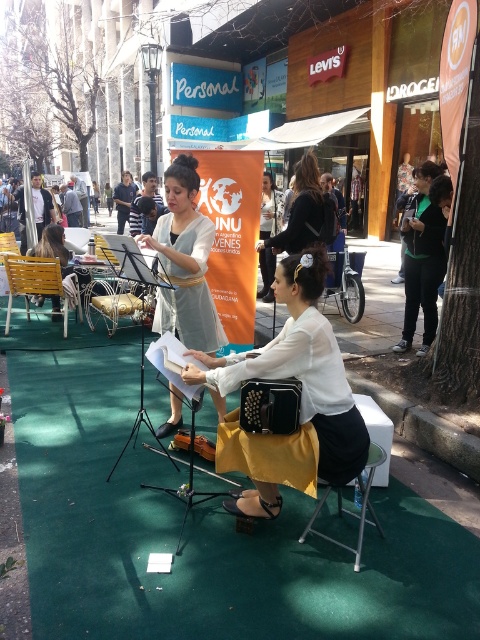
Question: Is white matte accordion at center positioned before matte black hairband at center?

Choices:
 (A) no
 (B) yes

Answer: (B)

Question: Which of the following is the closest to the observer?

Choices:
 (A) (74, 273)
 (B) (6, 328)

Answer: (B)

Question: Considering the relative positions of matte gray dress at center and wooden accordion at center in the image provided, where is matte gray dress at center located with respect to wooden accordion at center?

Choices:
 (A) below
 (B) above

Answer: (B)

Question: Does white matte accordion at center appear on the right side of metallic silver folding chair at center?

Choices:
 (A) no
 (B) yes

Answer: (A)

Question: Which of these objects is positioned closest to the yellow plastic chair at left?

Choices:
 (A) matte black hairband at center
 (B) matte gray dress at center
 (C) white matte accordion at center
 (D) wooden accordion at center

Answer: (A)

Question: Which object is closer to the camera taking this photo?

Choices:
 (A) matte gray dress at center
 (B) white matte accordion at center

Answer: (B)